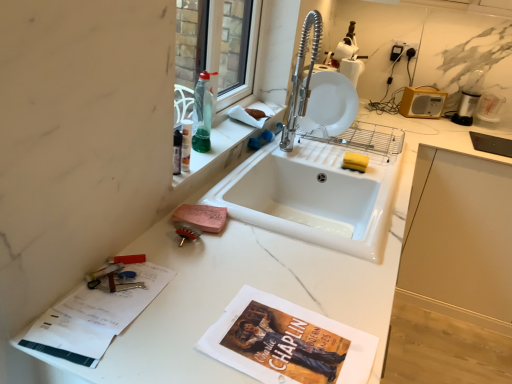
Where is `free point to the right of white glossy plate at upper center`? The height and width of the screenshot is (384, 512). free point to the right of white glossy plate at upper center is located at coordinates (361, 137).